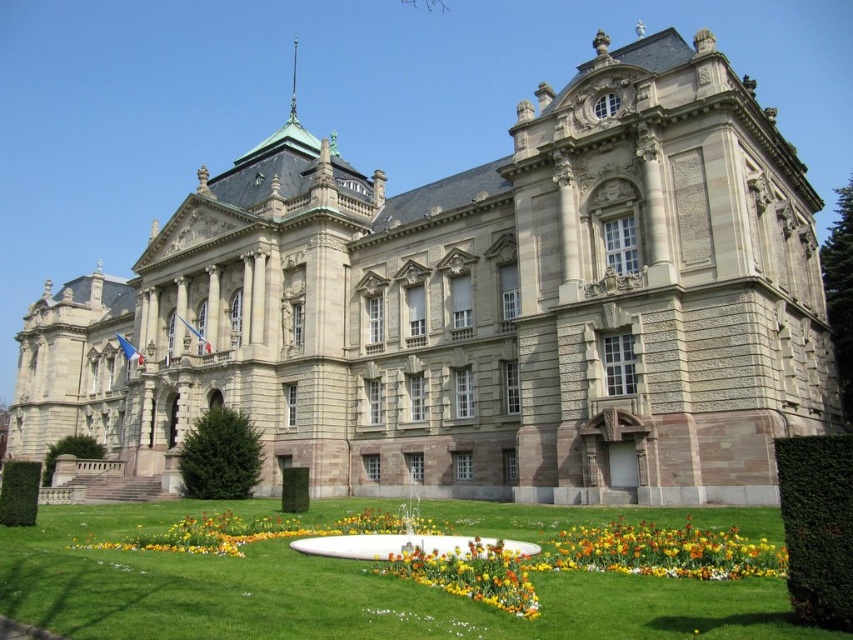
You are a landscape architect designing a garden for this building. You need to place a small statue that requires a base area of 1 square meter. Given the green grass at center and vibrant multicolored petals at lower center, which area would be suitable for placing the statue?

The green grass at center is bigger than vibrant multicolored petals at lower center, so the green grass at center can accommodate the statue requiring a base area of 1 square meter.

You are a landscape architect planning to place a new statue in the garden. The statue requires a base that is wider than both the green grass at center and the multicolored fabric flower bed at center. Which area should you choose for the statue base?

A: The green grass at center is wider than the multicolored fabric flower bed at center, so the statue base should be placed on the green grass at center to ensure it is wider than both areas.